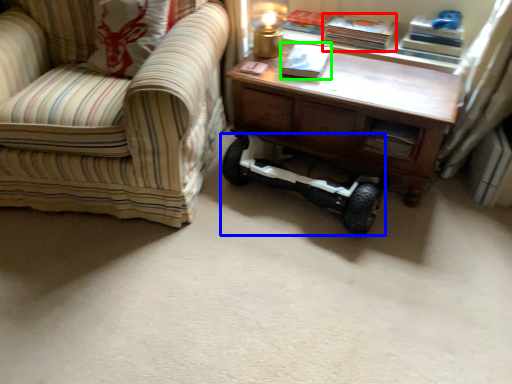
Question: Considering the real-world distances, which object is closest to book (highlighted by a red box)? segway (highlighted by a blue box) or book (highlighted by a green box).

Choices:
 (A) segway
 (B) book

Answer: (B)